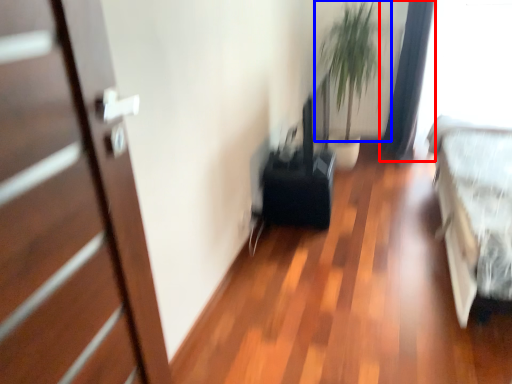
Question: Which of the following is the farthest to the observer, curtain (highlighted by a red box) or plant (highlighted by a blue box)?

Choices:
 (A) curtain
 (B) plant

Answer: (B)